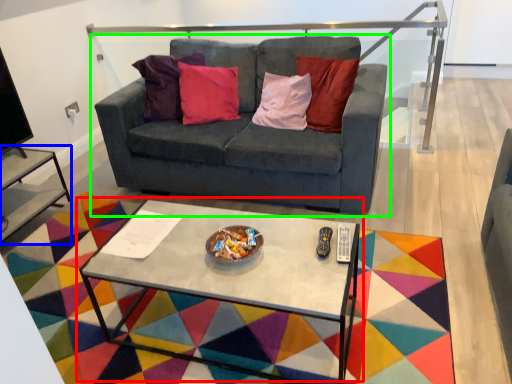
Question: Which object is the farthest from coffee table (highlighted by a red box)? Choose among these: side table (highlighted by a blue box) or studio couch (highlighted by a green box).

Choices:
 (A) side table
 (B) studio couch

Answer: (A)